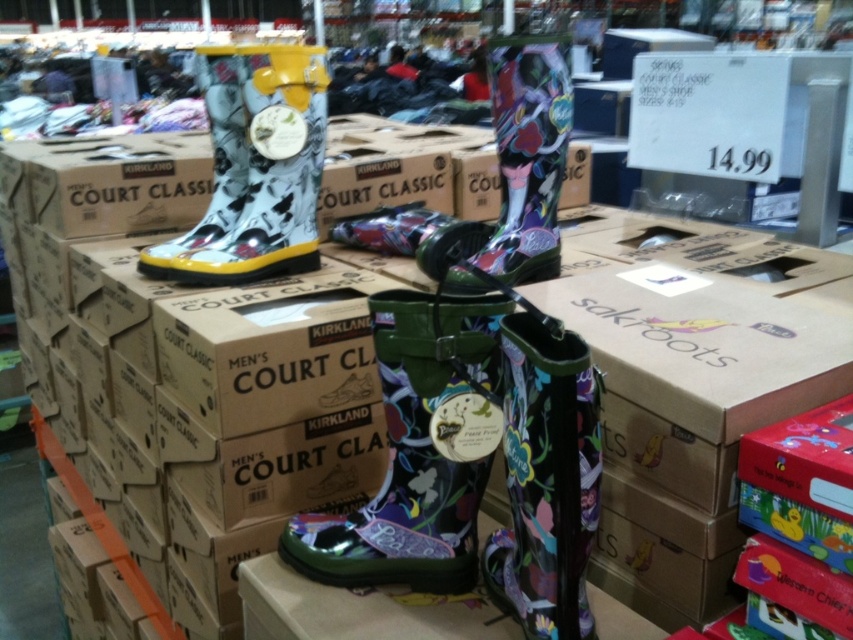
You are a customer in the store and want to find the green glossy rain boot at center. According to the store layout, where should you look relative to the white rain boots on the left?

The green glossy rain boot at center is located to the right of the white rain boots on the left, as it is positioned at point 0.703 on the x axis which is further to the right compared to the white rain boots.

You are a customer trying to choose between the green glossy rain boot at center and the matte rubber boot at upper left. If you want a wider boot, which one should you pick?

The green glossy rain boot at center has a larger width than the matte rubber boot at upper left, so you should pick the green glossy rain boot at center.